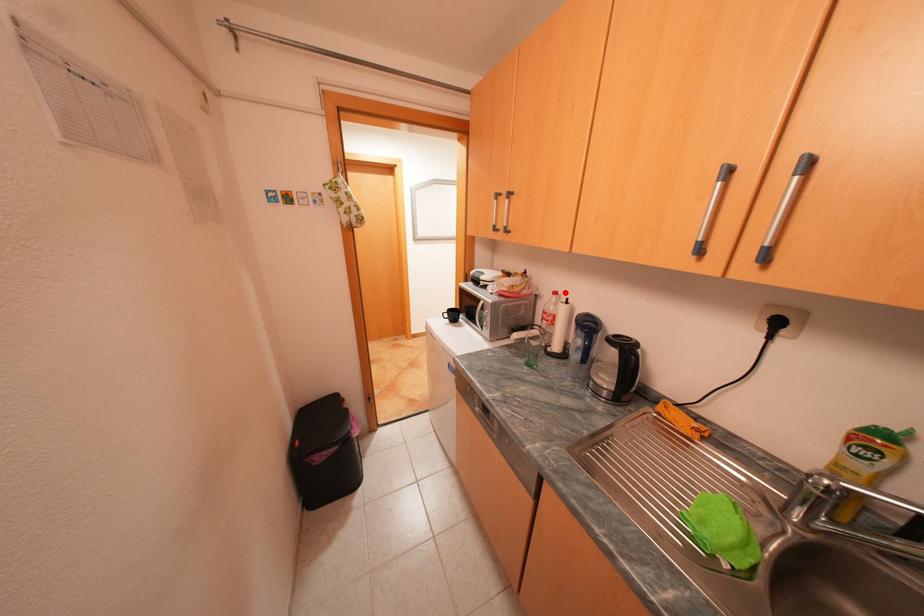
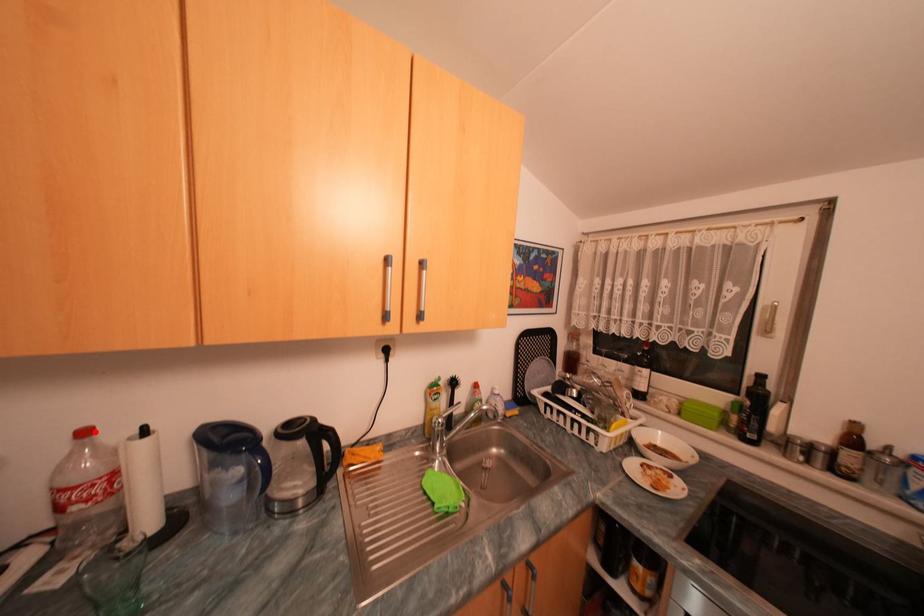
I am providing you with two images of the same scene from different viewpoints. A red point is marked on the first image and another point is marked on the second image. Do the highlighted points in image1 and image2 indicate the same real-world spot?

Yes